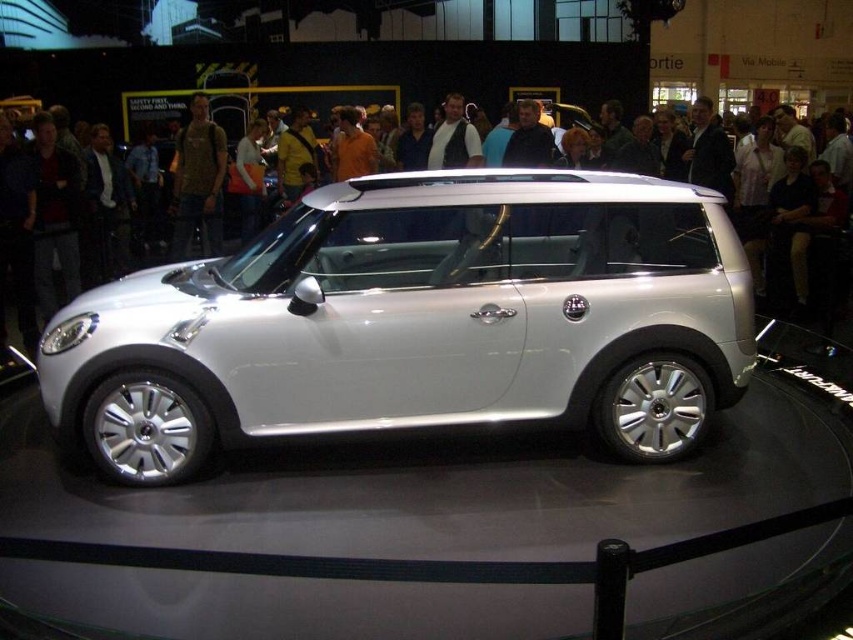
Question: Is white metallic car at center smaller than matte white car at center?

Choices:
 (A) no
 (B) yes

Answer: (A)

Question: Which object is farther from the camera taking this photo?

Choices:
 (A) matte white car at center
 (B) white metallic car at center

Answer: (A)

Question: Among these points, which one is nearest to the camera?

Choices:
 (A) (375, 227)
 (B) (296, 364)

Answer: (B)

Question: Is white metallic car at center positioned before matte white car at center?

Choices:
 (A) no
 (B) yes

Answer: (B)

Question: Can you confirm if white metallic car at center is thinner than matte white car at center?

Choices:
 (A) yes
 (B) no

Answer: (B)